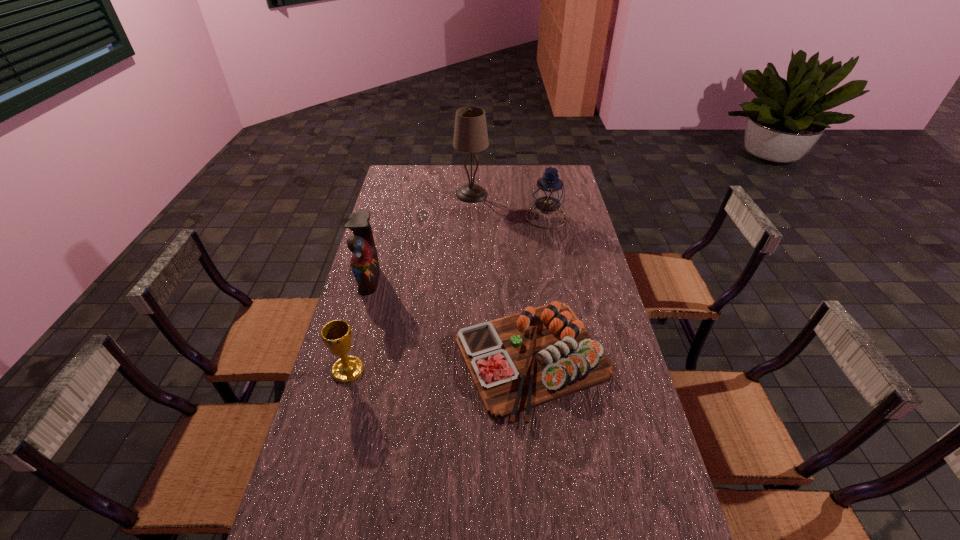
The height and width of the screenshot is (540, 960). Find the location of `vacant area in the image that satisfies the following two spatial constraints: 1. on the front-facing side of the platter; 2. on the right side of the lampshade`. vacant area in the image that satisfies the following two spatial constraints: 1. on the front-facing side of the platter; 2. on the right side of the lampshade is located at coordinates (468, 359).

Where is `free space that satisfies the following two spatial constraints: 1. on the back side of the chalice; 2. on the left side of the platter`? The image size is (960, 540). free space that satisfies the following two spatial constraints: 1. on the back side of the chalice; 2. on the left side of the platter is located at coordinates (351, 359).

This screenshot has width=960, height=540. I want to click on vacant space that satisfies the following two spatial constraints: 1. at the face of the platter; 2. on the left side of the third farthest object, so click(347, 359).